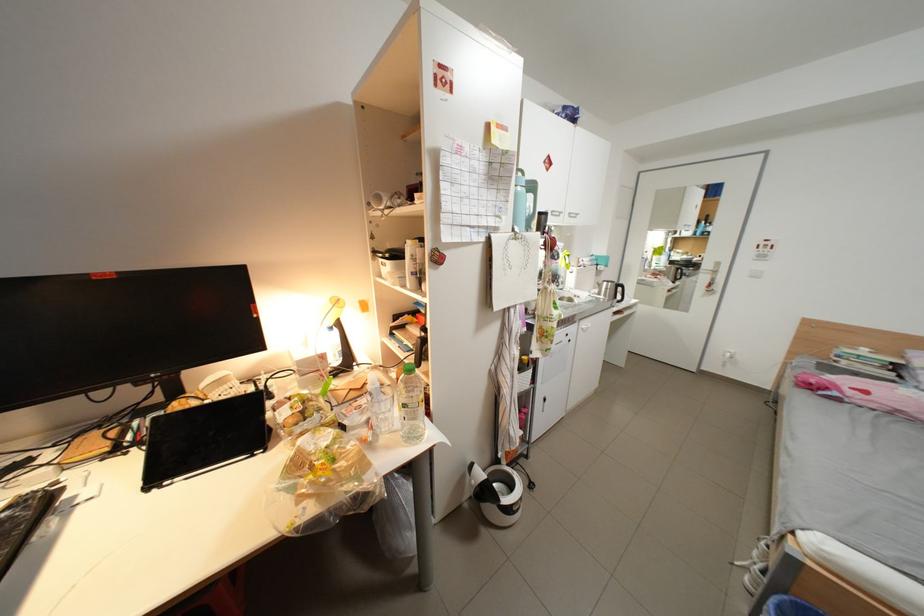
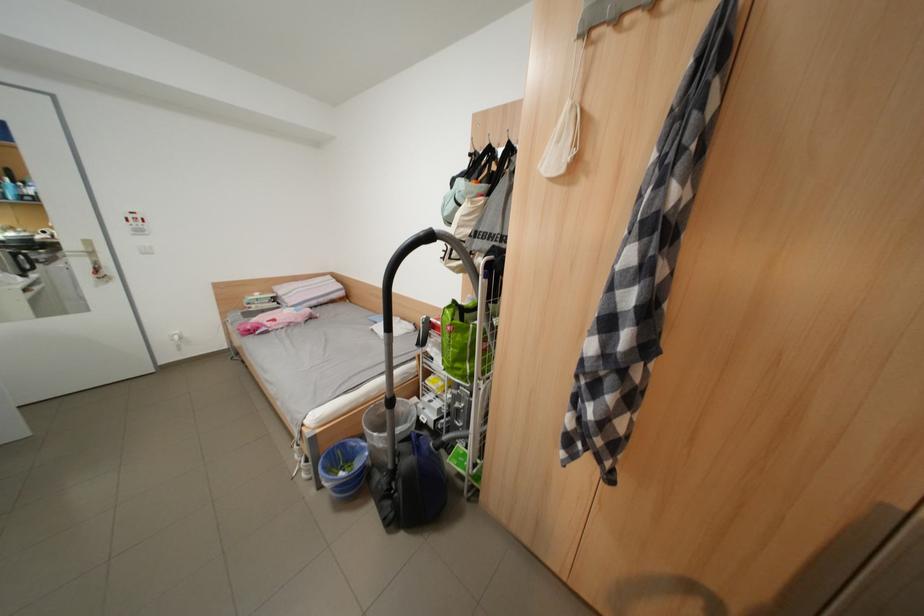
Find the pixel in the second image that matches [824,382] in the first image.

(261, 329)